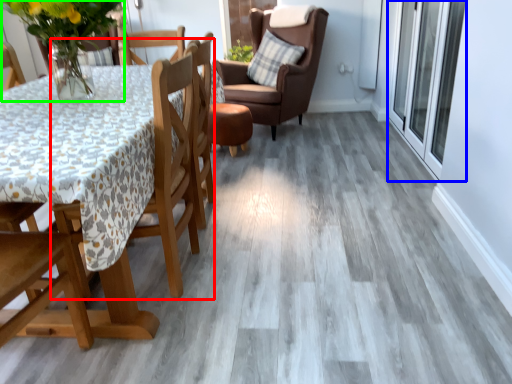
Question: Considering the real-world distances, which object is closest to chair (highlighted by a red box)? screen door (highlighted by a blue box) or floral arrangement (highlighted by a green box).

Choices:
 (A) screen door
 (B) floral arrangement

Answer: (B)